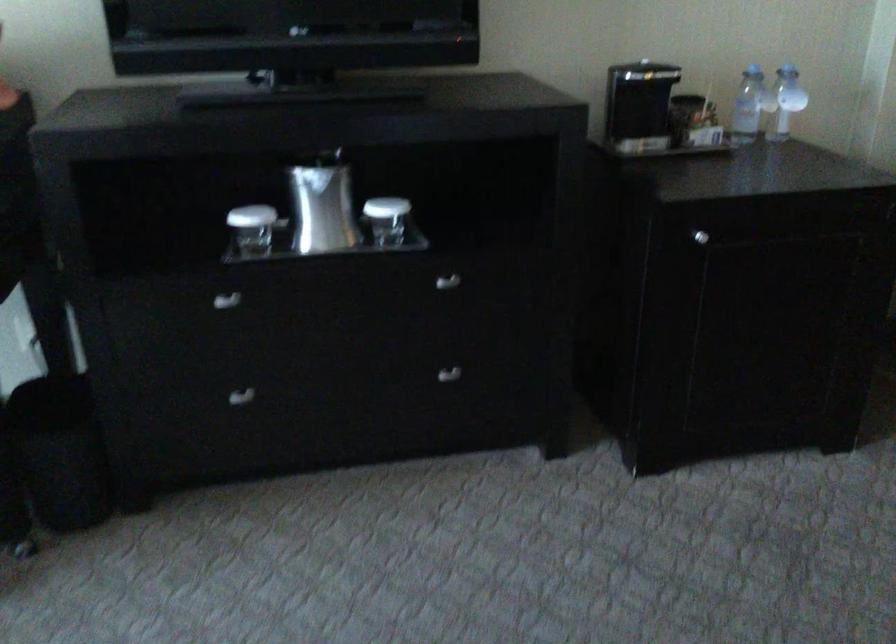
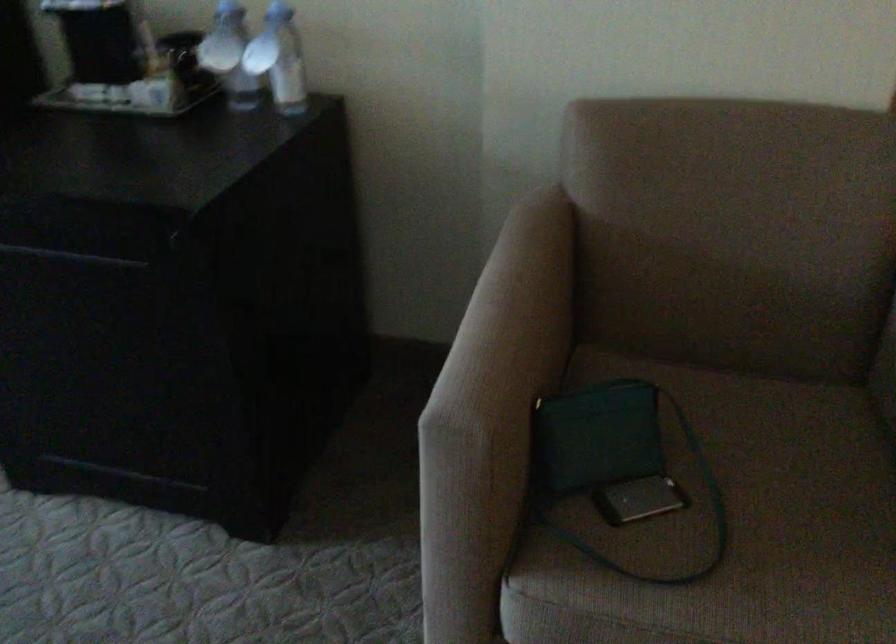
What movement of the cameraman would produce the second image?

The cameraman moved toward right, forward.